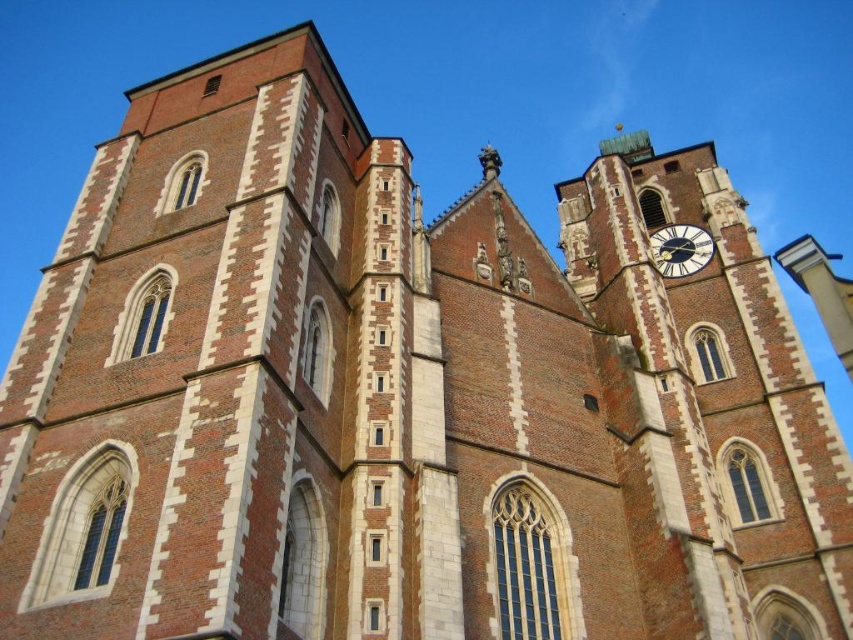
Question: Can you confirm if brick and stone clock tower at center is bigger than blue painted metal clock at upper right?

Choices:
 (A) yes
 (B) no

Answer: (A)

Question: Which point appears farthest from the camera in this image?

Choices:
 (A) (664, 240)
 (B) (686, 488)

Answer: (A)

Question: Can you confirm if brick and stone clock tower at center is positioned to the right of blue painted metal clock at upper right?

Choices:
 (A) no
 (B) yes

Answer: (A)

Question: Is brick and stone clock tower at center to the right of blue painted metal clock at upper right from the viewer's perspective?

Choices:
 (A) no
 (B) yes

Answer: (A)

Question: Among these objects, which one is farthest from the camera?

Choices:
 (A) brick and stone clock tower at center
 (B) blue painted metal clock at upper right

Answer: (B)